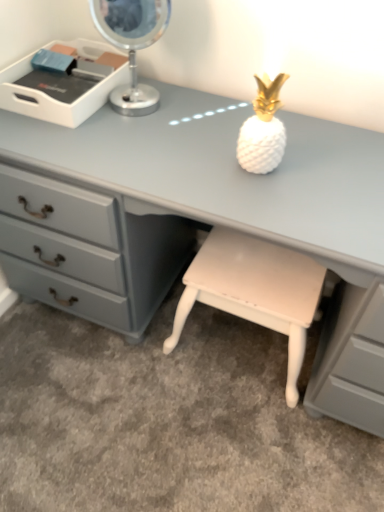
Question: Are metallic silver table lamp at upper left and white plastic tray at upper left far apart?

Choices:
 (A) no
 (B) yes

Answer: (A)

Question: Is white plastic tray at upper left completely or partially inside metallic silver table lamp at upper left?

Choices:
 (A) yes
 (B) no

Answer: (B)

Question: Is metallic silver table lamp at upper left closer to the viewer compared to white plastic tray at upper left?

Choices:
 (A) no
 (B) yes

Answer: (B)

Question: Can you see metallic silver table lamp at upper left touching white plastic tray at upper left?

Choices:
 (A) no
 (B) yes

Answer: (A)

Question: Is metallic silver table lamp at upper left not inside white plastic tray at upper left?

Choices:
 (A) yes
 (B) no

Answer: (A)

Question: From a real-world perspective, is white plastic tray at upper left positioned above or below matte gray desk at center?

Choices:
 (A) above
 (B) below

Answer: (A)

Question: From their relative heights in the image, would you say white plastic tray at upper left is taller or shorter than matte gray desk at center?

Choices:
 (A) short
 (B) tall

Answer: (A)

Question: Is white plastic tray at upper left in front of or behind matte gray desk at center in the image?

Choices:
 (A) behind
 (B) front

Answer: (A)

Question: Is point (102, 89) positioned closer to the camera than point (370, 419)?

Choices:
 (A) farther
 (B) closer

Answer: (B)

Question: Do you think metallic silver table lamp at upper left is within white plastic tray at upper left, or outside of it?

Choices:
 (A) inside
 (B) outside

Answer: (B)

Question: Does point (167, 20) appear closer or farther from the camera than point (81, 44)?

Choices:
 (A) farther
 (B) closer

Answer: (B)

Question: From a real-world perspective, is metallic silver table lamp at upper left positioned above or below white plastic tray at upper left?

Choices:
 (A) above
 (B) below

Answer: (A)

Question: Is metallic silver table lamp at upper left wider or thinner than white plastic tray at upper left?

Choices:
 (A) thin
 (B) wide

Answer: (A)

Question: Would you say matte gray desk at center is to the left or to the right of metallic silver table lamp at upper left in the picture?

Choices:
 (A) right
 (B) left

Answer: (A)

Question: Based on their sizes in the image, would you say matte gray desk at center is bigger or smaller than metallic silver table lamp at upper left?

Choices:
 (A) small
 (B) big

Answer: (B)